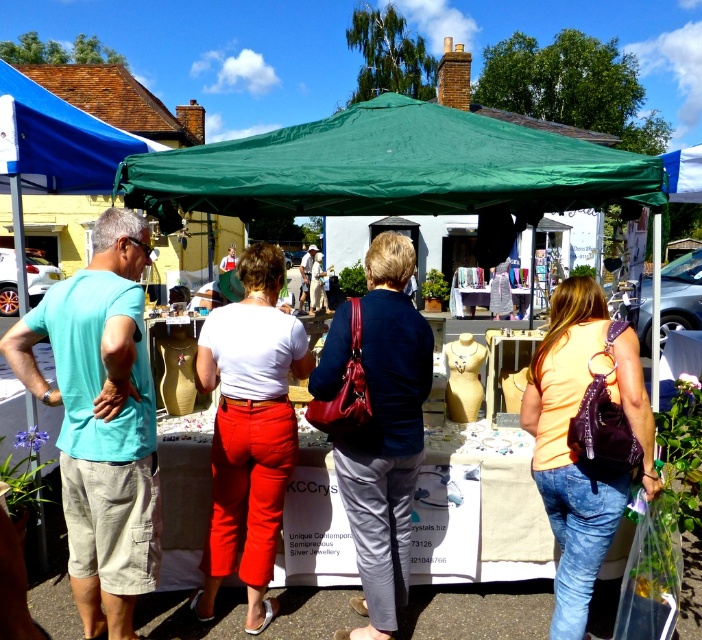
Question: Is matte white blouse at center to the right of matte red handbag at center from the viewer's perspective?

Choices:
 (A) yes
 (B) no

Answer: (B)

Question: Is teal fabric shirt at left further to the viewer compared to matte red handbag at center?

Choices:
 (A) yes
 (B) no

Answer: (B)

Question: Among these points, which one is farthest from the camera?

Choices:
 (A) (117, 600)
 (B) (562, 328)
 (C) (600, 186)
 (D) (206, 353)

Answer: (C)

Question: Which object is closer to the camera taking this photo?

Choices:
 (A) orange matte backpack at right
 (B) teal fabric shirt at left
 (C) matte red handbag at center
 (D) green fabric canopy at center

Answer: (A)

Question: Is matte red handbag at center to the left of blue fabric canopy at upper left from the viewer's perspective?

Choices:
 (A) no
 (B) yes

Answer: (A)

Question: Based on their relative distances, which object is nearer to the green fabric canopy at center?

Choices:
 (A) blue fabric canopy at upper left
 (B) orange matte backpack at right

Answer: (B)